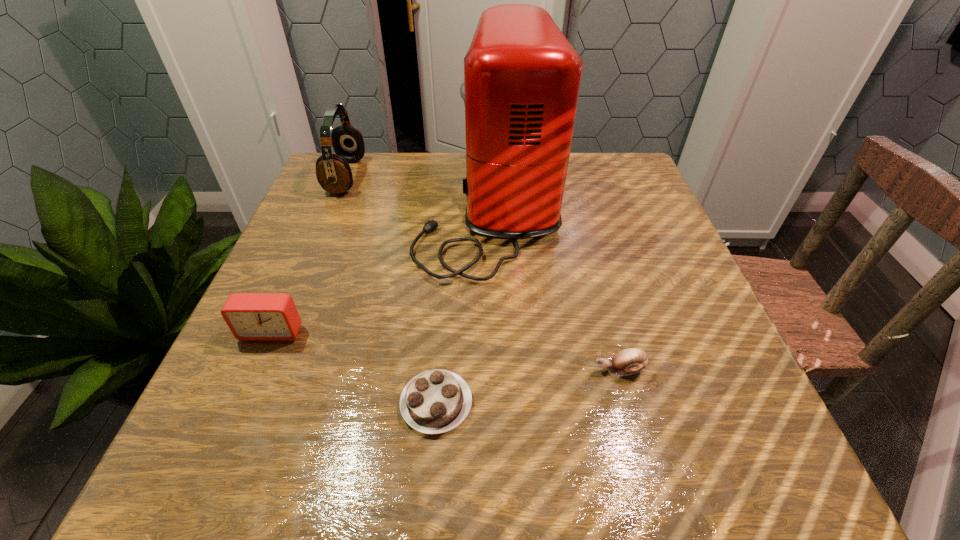
I want to click on the tallest object, so click(x=522, y=77).

Identify the location of headset. The image size is (960, 540). (333, 172).

This screenshot has width=960, height=540. Find the location of `the third nearest object`. the third nearest object is located at coordinates (250, 316).

You are a GUI agent. You are given a task and a screenshot of the screen. Output one action in this format:
    pyautogui.click(x=<x>, y=<y>)
    Task: Click on the third shortest object
    
    Given the screenshot: What is the action you would take?
    pyautogui.click(x=250, y=316)

Find the location of a particular element. the fourth tallest object is located at coordinates (630, 361).

In order to click on the shortest object in this screenshot , I will do `click(436, 401)`.

You are a GUI agent. You are given a task and a screenshot of the screen. Output one action in this format:
    pyautogui.click(x=<x>, y=<y>)
    Task: Click on the vacant space situated 0.130m on the front-facing side of the tallest object
    The image size is (960, 540).
    Given the screenshot: What is the action you would take?
    pyautogui.click(x=363, y=208)

Where is `vacant space positioned 0.070m on the front-facing side of the tallest object`? vacant space positioned 0.070m on the front-facing side of the tallest object is located at coordinates (388, 208).

Locate an element on the screen. vacant space located on the ear cups of the second tallest object is located at coordinates (518, 176).

The image size is (960, 540). Identify the location of vacant space located 0.050m on the front-facing side of the third shortest object. (256, 368).